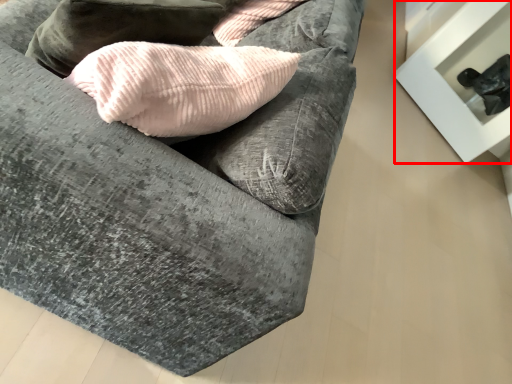
Question: From the image's perspective, where is furniture (annotated by the red box) located relative to studio couch?

Choices:
 (A) above
 (B) below

Answer: (A)